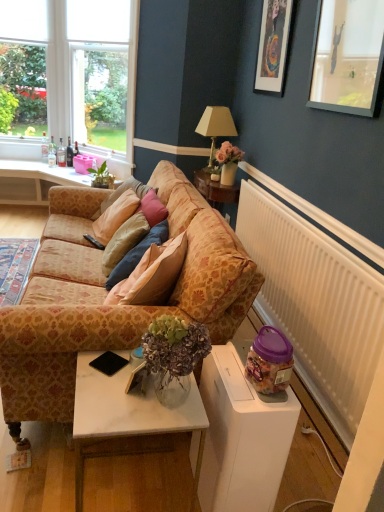
Question: Is white marble table at lower center directly adjacent to clear glass bottle at left, the 2th bottle when ordered from right to left?

Choices:
 (A) no
 (B) yes

Answer: (A)

Question: Does white marble table at lower center have a lesser height compared to clear glass bottle at left, placed as the 3th bottle when sorted from left to right?

Choices:
 (A) no
 (B) yes

Answer: (A)

Question: From a real-world perspective, is white marble table at lower center beneath clear glass bottle at left, the 2th bottle when ordered from right to left?

Choices:
 (A) yes
 (B) no

Answer: (A)

Question: Does white marble table at lower center have a smaller size compared to clear glass bottle at left, placed as the 3th bottle when sorted from left to right?

Choices:
 (A) yes
 (B) no

Answer: (B)

Question: Does white marble table at lower center appear on the right side of clear glass bottle at left, placed as the 3th bottle when sorted from left to right?

Choices:
 (A) yes
 (B) no

Answer: (A)

Question: Is there a large distance between white marble table at lower center and clear glass bottle at left, placed as the 3th bottle when sorted from left to right?

Choices:
 (A) no
 (B) yes

Answer: (B)

Question: Does dark brown glass bottle at left, positioned as the first bottle in right-to-left order, have a greater height compared to clear glass window at upper left?

Choices:
 (A) yes
 (B) no

Answer: (B)

Question: Is dark brown glass bottle at left, placed as the 4th bottle when sorted from left to right, outside clear glass window at upper left?

Choices:
 (A) no
 (B) yes

Answer: (B)

Question: Does dark brown glass bottle at left, placed as the 4th bottle when sorted from left to right, have a lesser width compared to clear glass window at upper left?

Choices:
 (A) yes
 (B) no

Answer: (A)

Question: Does dark brown glass bottle at left, placed as the 4th bottle when sorted from left to right, have a greater width compared to clear glass window at upper left?

Choices:
 (A) no
 (B) yes

Answer: (A)

Question: From the image's perspective, is dark brown glass bottle at left, placed as the 4th bottle when sorted from left to right, on clear glass window at upper left?

Choices:
 (A) no
 (B) yes

Answer: (A)

Question: Does dark brown glass bottle at left, placed as the 4th bottle when sorted from left to right, have a larger size compared to clear glass window at upper left?

Choices:
 (A) yes
 (B) no

Answer: (B)

Question: Could clear glass window at upper left be considered to be inside black plastic remote control at center?

Choices:
 (A) yes
 (B) no

Answer: (B)